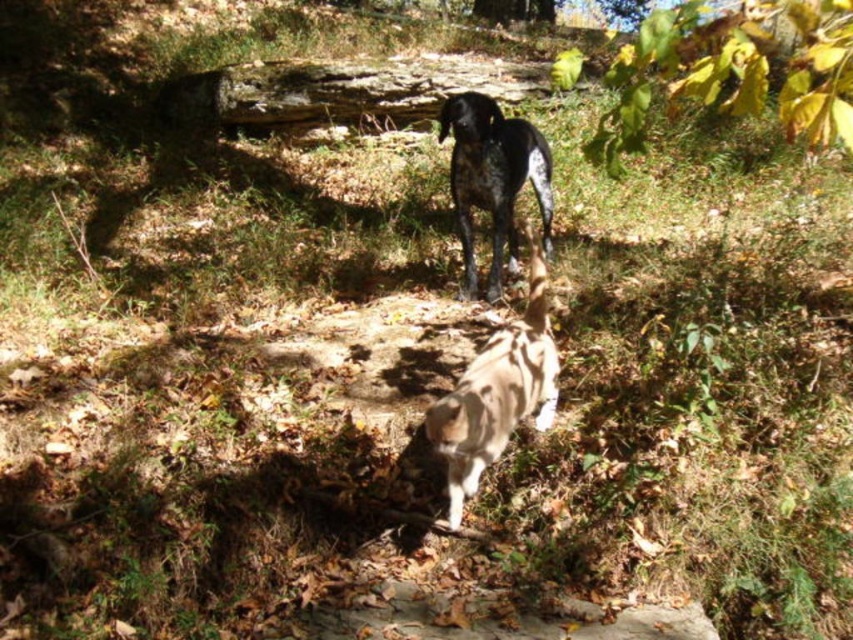
Question: Does spotted fur dog at center have a larger size compared to speckled fur dog at upper center?

Choices:
 (A) yes
 (B) no

Answer: (B)

Question: Among these points, which one is farthest from the camera?

Choices:
 (A) (498, 193)
 (B) (447, 397)

Answer: (A)

Question: Which object appears farthest from the camera in this image?

Choices:
 (A) speckled fur dog at upper center
 (B) spotted fur dog at center

Answer: (A)

Question: Among these points, which one is nearest to the camera?

Choices:
 (A) (509, 269)
 (B) (471, 380)

Answer: (B)

Question: Is the position of spotted fur dog at center less distant than that of speckled fur dog at upper center?

Choices:
 (A) no
 (B) yes

Answer: (B)

Question: From the image, what is the correct spatial relationship of spotted fur dog at center in relation to speckled fur dog at upper center?

Choices:
 (A) right
 (B) left

Answer: (B)